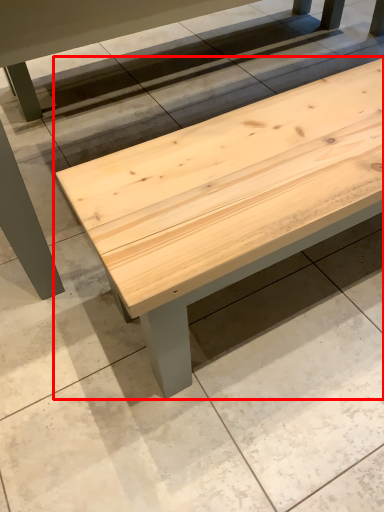
Question: From the image's perspective, where is table (annotated by the red box) located relative to concrete?

Choices:
 (A) below
 (B) above

Answer: (B)